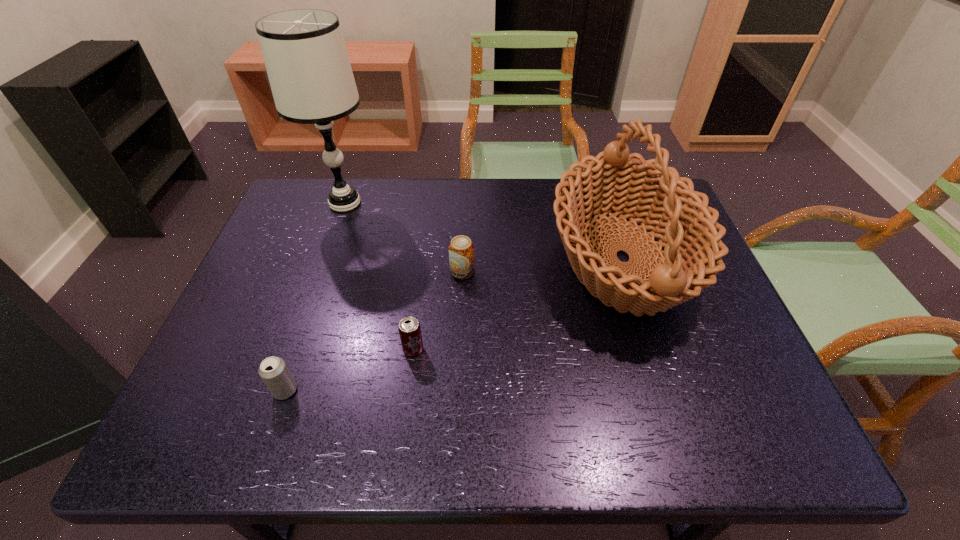
In the image, there is a desktop. Find the location of `vacant space at the far edge`. vacant space at the far edge is located at coordinates (391, 217).

The image size is (960, 540). Find the location of `free space at the near edge of the desktop`. free space at the near edge of the desktop is located at coordinates (688, 447).

The image size is (960, 540). I want to click on free region at the left edge of the desktop, so click(296, 246).

The height and width of the screenshot is (540, 960). Find the location of `blank area at the right edge`. blank area at the right edge is located at coordinates click(x=720, y=336).

This screenshot has height=540, width=960. In the image, there is a desktop. Find the location of `vacant space at the far left corner`. vacant space at the far left corner is located at coordinates (324, 183).

In the image, there is a desktop. Identify the location of vacant space at the near right corner. Image resolution: width=960 pixels, height=540 pixels. (756, 438).

Identify the location of vacant space that's between the nearest beer can and the basket. The width and height of the screenshot is (960, 540). (453, 325).

Image resolution: width=960 pixels, height=540 pixels. What are the coordinates of `vacant space that's between the nearest beer can and the tallest object` in the screenshot? It's located at (315, 297).

You are a GUI agent. You are given a task and a screenshot of the screen. Output one action in this format:
    pyautogui.click(x=<x>, y=<y>)
    Task: Click on the vacant space that is in between the second farthest beer can and the table lamp
    
    Given the screenshot: What is the action you would take?
    pyautogui.click(x=379, y=276)

Where is `unoccupied area between the second farthest beer can and the table lamp`? The width and height of the screenshot is (960, 540). unoccupied area between the second farthest beer can and the table lamp is located at coordinates (379, 276).